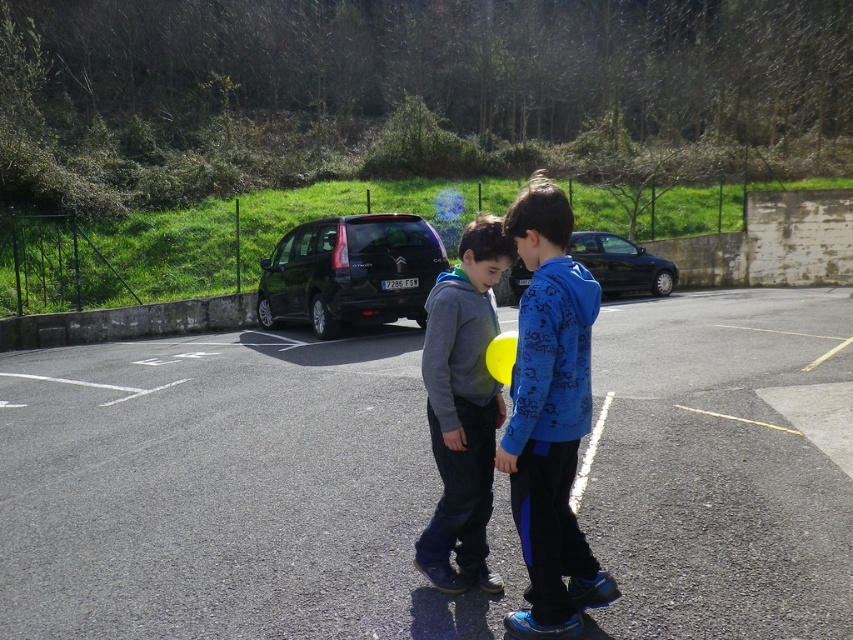
You are standing at the point with coordinates [463,408] in the image. What object are you touching?

The point at coordinates [463,408] is on the gray fleece hoodie at center.